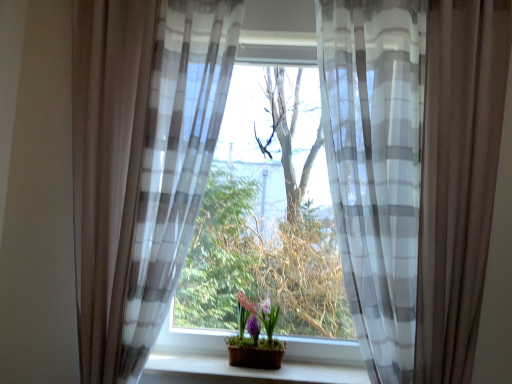
You are a GUI agent. You are given a task and a screenshot of the screen. Output one action in this format:
    pyautogui.click(x=<x>, y=<y>)
    Task: Click on the free spot above wooden at center (from a real-world perspective)
    
    Given the screenshot: What is the action you would take?
    pyautogui.click(x=269, y=368)